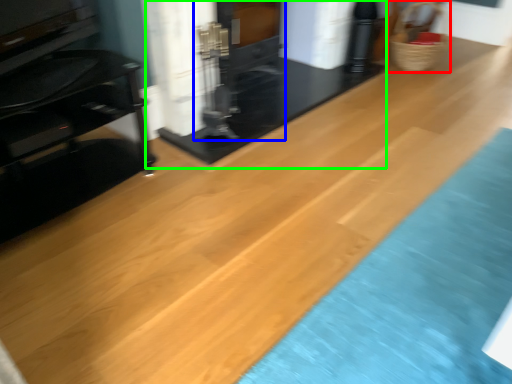
Question: Estimate the real-world distances between objects in this image. Which object is closer to basket (highlighted by a red box), fireplace (highlighted by a blue box) or fireplace (highlighted by a green box)?

Choices:
 (A) fireplace
 (B) fireplace

Answer: (B)